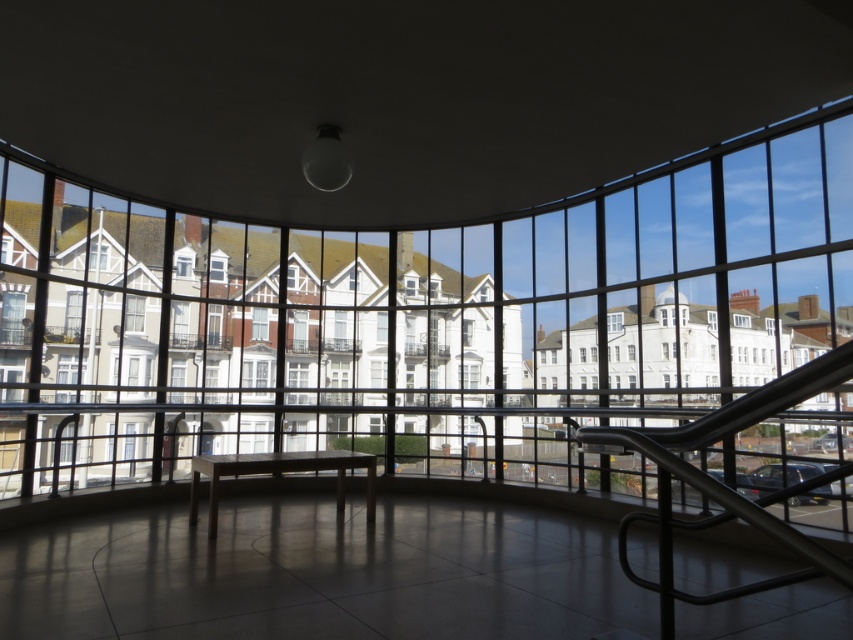
In the scene shown: Can you confirm if clear glass window at upper left is positioned to the left of clear glass window at center?

Indeed, clear glass window at upper left is positioned on the left side of clear glass window at center.

Is clear glass window at upper left smaller than clear glass window at center?

Correct, clear glass window at upper left occupies less space than clear glass window at center.

Image resolution: width=853 pixels, height=640 pixels. What do you see at coordinates (97, 253) in the screenshot?
I see `clear glass window at upper left` at bounding box center [97, 253].

In order to click on clear glass window at upper left in this screenshot , I will do `click(97, 253)`.

Which is more to the right, wooden at center or clear glass window at center?

clear glass window at center

Can you confirm if wooden at center is positioned above clear glass window at center?

No, wooden at center is not above clear glass window at center.

Between point (239, 458) and point (612, 324), which one is positioned behind?

Positioned behind is point (612, 324).

You are a GUI agent. You are given a task and a screenshot of the screen. Output one action in this format:
    pyautogui.click(x=<x>, y=<y>)
    Task: Click on the wooden at center
    
    Given the screenshot: What is the action you would take?
    pyautogui.click(x=277, y=474)

Which of these two, wooden at center or clear glass window at upper left, stands taller?

clear glass window at upper left is taller.

Does wooden at center appear on the right side of clear glass window at upper left?

Indeed, wooden at center is positioned on the right side of clear glass window at upper left.

Does point (335, 451) come in front of point (96, 248)?

That is True.

Identify the location of wooden at center. (277, 474).